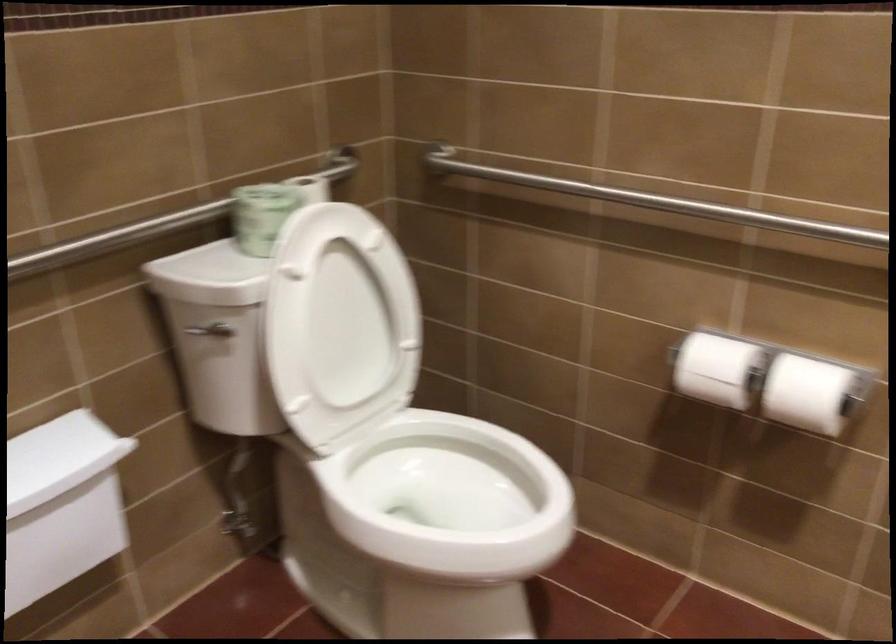
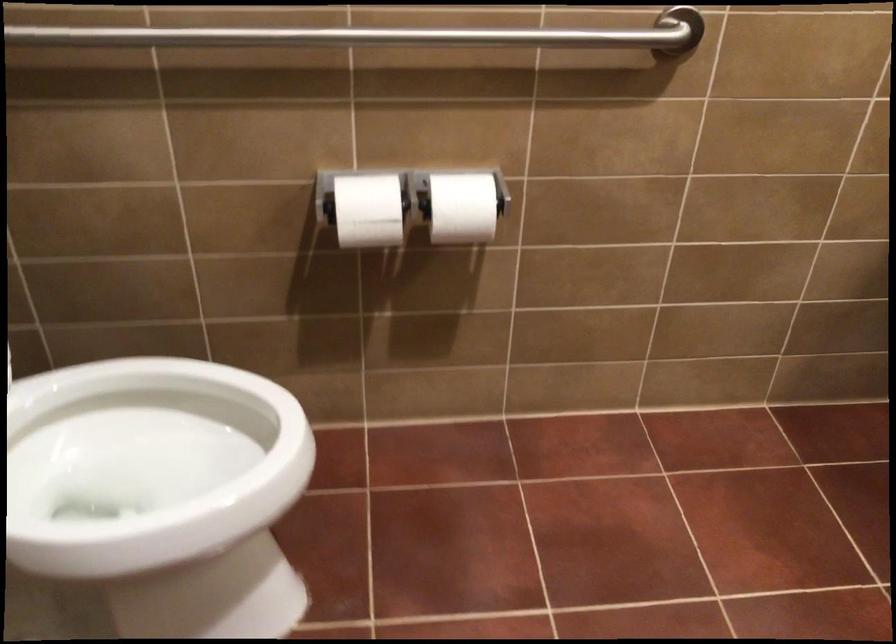
Question: How did the camera likely rotate?

Choices:
 (A) Left
 (B) Right
 (C) Up
 (D) Down

Answer: (B)